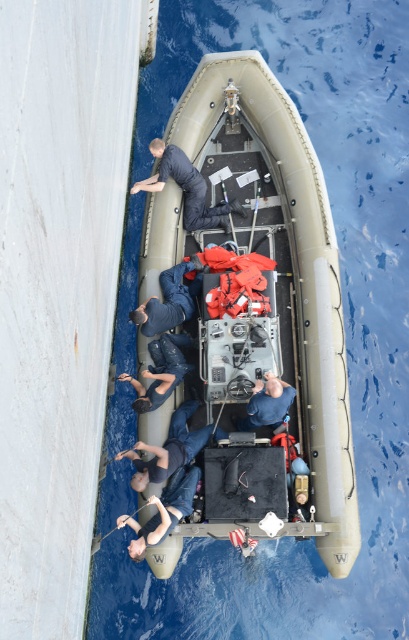
Question: Which point is farther to the camera?

Choices:
 (A) (242, 426)
 (B) (193, 438)

Answer: (A)

Question: Can you confirm if dark blue uniform at center is smaller than blue denim jeans at lower center?

Choices:
 (A) yes
 (B) no

Answer: (B)

Question: Which object is farther from the camera taking this photo?

Choices:
 (A) tan rubber boat at center
 (B) blue denim jeans at lower center
 (C) blue fabric diver at center

Answer: (C)

Question: In this image, where is tan rubber boat at center located relative to dark blue fabric at center?

Choices:
 (A) left
 (B) right

Answer: (B)

Question: Is tan rubber boat at center further to the viewer compared to blue denim jeans at lower center?

Choices:
 (A) yes
 (B) no

Answer: (A)

Question: Which point is closer to the camera?

Choices:
 (A) blue rubber diver at center
 (B) dark blue uniform at center
 (C) tan rubber boat at center

Answer: (A)